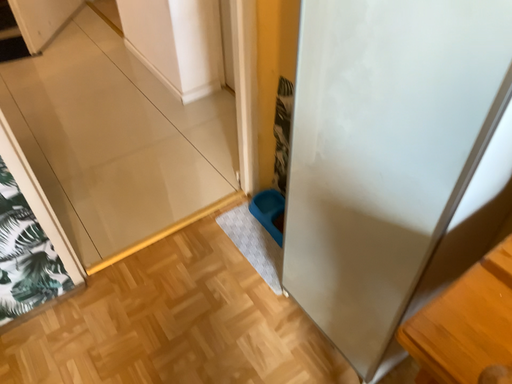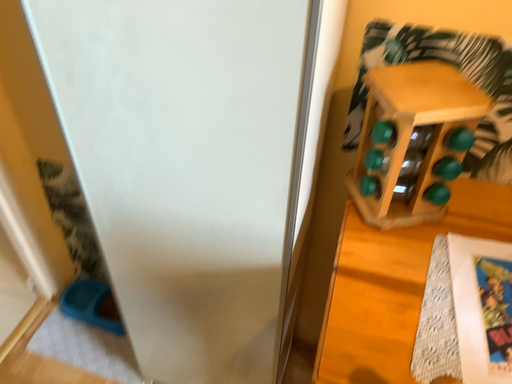
Question: Which way did the camera rotate in the video?

Choices:
 (A) rotated left
 (B) rotated right

Answer: (B)